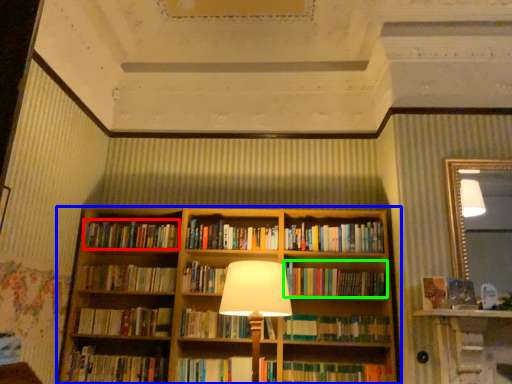
Question: Based on their relative distances, which object is nearer to book (highlighted by a red box)? Choose from bookcase (highlighted by a blue box) and book (highlighted by a green box).

Choices:
 (A) bookcase
 (B) book

Answer: (A)